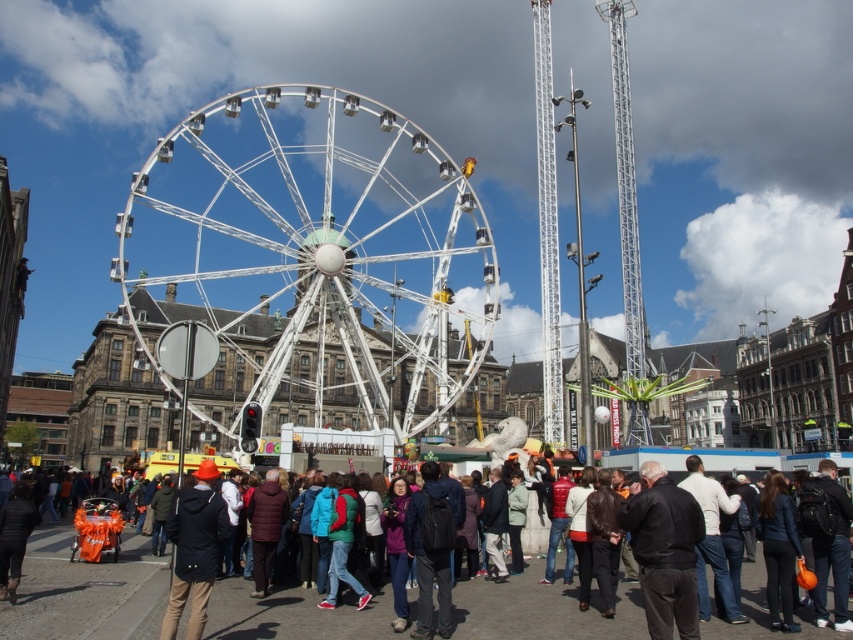
Question: Can you confirm if white metallic ferris wheel at center is positioned to the left of matte black jacket at lower left?

Choices:
 (A) yes
 (B) no

Answer: (A)

Question: Which point appears farthest from the camera in this image?

Choices:
 (A) (183, 584)
 (B) (381, 109)
 (C) (662, 486)

Answer: (B)

Question: Is white metallic ferris wheel at center positioned at the back of orange fabric bag at center?

Choices:
 (A) yes
 (B) no

Answer: (A)

Question: Among these objects, which one is nearest to the camera?

Choices:
 (A) matte black jacket at lower left
 (B) orange fabric bag at center
 (C) white metallic ferris wheel at center

Answer: (A)

Question: Does white metallic ferris wheel at center have a greater width compared to orange fabric bag at center?

Choices:
 (A) yes
 (B) no

Answer: (A)

Question: Which of these objects is positioned closest to the matte black jacket at lower left?

Choices:
 (A) black leather jacket at center
 (B) white metallic ferris wheel at center
 (C) orange fabric bag at center

Answer: (C)